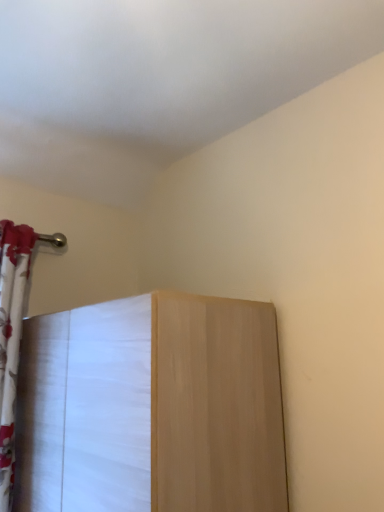
Question: From a real-world perspective, is light wood cabinet at center below white floral fabric curtain at left?

Choices:
 (A) no
 (B) yes

Answer: (B)

Question: Does light wood cabinet at center have a larger size compared to white floral fabric curtain at left?

Choices:
 (A) yes
 (B) no

Answer: (A)

Question: Does light wood cabinet at center lie behind white floral fabric curtain at left?

Choices:
 (A) yes
 (B) no

Answer: (B)

Question: Can you confirm if light wood cabinet at center is shorter than white floral fabric curtain at left?

Choices:
 (A) yes
 (B) no

Answer: (A)

Question: Considering the relative positions of light wood cabinet at center and white floral fabric curtain at left in the image provided, is light wood cabinet at center to the right of white floral fabric curtain at left from the viewer's perspective?

Choices:
 (A) yes
 (B) no

Answer: (A)

Question: From the image's perspective, is light wood cabinet at center located beneath white floral fabric curtain at left?

Choices:
 (A) no
 (B) yes

Answer: (B)

Question: Does white floral fabric curtain at left have a lesser width compared to light wood cabinet at center?

Choices:
 (A) no
 (B) yes

Answer: (B)

Question: From a real-world perspective, is white floral fabric curtain at left located beneath light wood cabinet at center?

Choices:
 (A) no
 (B) yes

Answer: (A)

Question: Is white floral fabric curtain at left taller than light wood cabinet at center?

Choices:
 (A) yes
 (B) no

Answer: (A)

Question: Considering the relative sizes of white floral fabric curtain at left and light wood cabinet at center in the image provided, is white floral fabric curtain at left wider than light wood cabinet at center?

Choices:
 (A) no
 (B) yes

Answer: (A)

Question: Is light wood cabinet at center a part of white floral fabric curtain at left?

Choices:
 (A) no
 (B) yes

Answer: (A)

Question: From the image's perspective, is white floral fabric curtain at left below light wood cabinet at center?

Choices:
 (A) yes
 (B) no

Answer: (B)

Question: Relative to white floral fabric curtain at left, is light wood cabinet at center in front or behind?

Choices:
 (A) front
 (B) behind

Answer: (A)